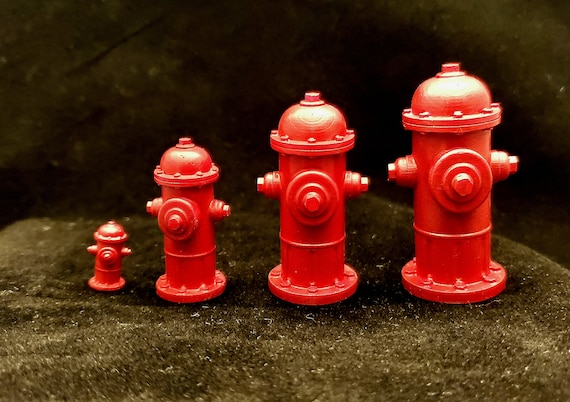
At what (x,y) coordinates should I click in order to perform the action: click on red paint. Please return your answer as a coordinate pair (x, y). This screenshot has width=570, height=402. Looking at the image, I should click on (107, 272), (186, 267), (324, 274), (447, 257).